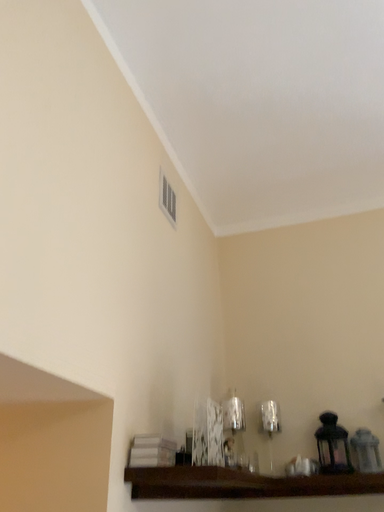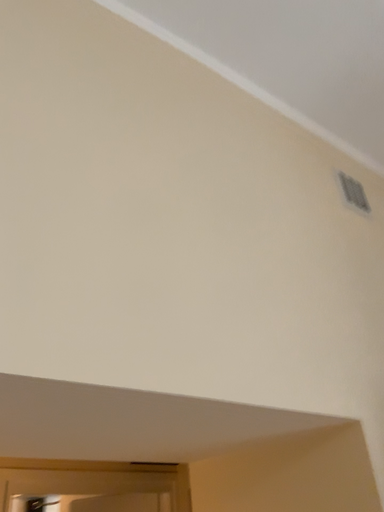
Question: Which way did the camera rotate in the video?

Choices:
 (A) rotated right
 (B) rotated left

Answer: (B)